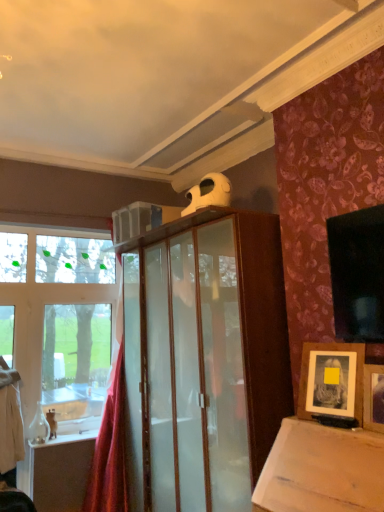
Question: Is wooden framed photo at lower right, the first picture frame viewed from the back, at the left side of red velvet curtain at left?

Choices:
 (A) yes
 (B) no

Answer: (B)

Question: Could you tell me if wooden framed photo at lower right, the 2th picture frame when ordered from front to back, is turned towards red velvet curtain at left?

Choices:
 (A) no
 (B) yes

Answer: (A)

Question: Is wooden framed photo at lower right, the 2th picture frame when ordered from front to back, facing away from red velvet curtain at left?

Choices:
 (A) yes
 (B) no

Answer: (B)

Question: Is wooden framed photo at lower right, the 2th picture frame when ordered from front to back, beside red velvet curtain at left?

Choices:
 (A) no
 (B) yes

Answer: (A)

Question: Is wooden framed photo at lower right, the 2th picture frame when ordered from front to back, far from red velvet curtain at left?

Choices:
 (A) no
 (B) yes

Answer: (B)

Question: Considering the positions of red velvet curtain at left and wooden framed photo at lower right, the 2th picture frame when ordered from front to back, in the image, is red velvet curtain at left wider or thinner than wooden framed photo at lower right, the 2th picture frame when ordered from front to back,?

Choices:
 (A) thin
 (B) wide

Answer: (B)

Question: Based on their sizes in the image, would you say red velvet curtain at left is bigger or smaller than wooden framed photo at lower right, the first picture frame viewed from the back?

Choices:
 (A) small
 (B) big

Answer: (B)

Question: Relative to wooden framed photo at lower right, the 2th picture frame when ordered from front to back, is red velvet curtain at left in front or behind?

Choices:
 (A) front
 (B) behind

Answer: (B)

Question: From the image's perspective, is red velvet curtain at left located above or below wooden framed photo at lower right, the 2th picture frame when ordered from front to back?

Choices:
 (A) above
 (B) below

Answer: (B)

Question: Based on their positions, is wooden framed photo at lower right, the 2th picture frame when ordered from front to back, located to the left or right of wooden picture frame at upper right, which ranks as the first picture frame in front-to-back order?

Choices:
 (A) left
 (B) right

Answer: (A)

Question: From a real-world perspective, is wooden framed photo at lower right, the 2th picture frame when ordered from front to back, positioned above or below wooden picture frame at upper right, which ranks as the first picture frame in front-to-back order?

Choices:
 (A) above
 (B) below

Answer: (A)

Question: In terms of width, does wooden framed photo at lower right, the 2th picture frame when ordered from front to back, look wider or thinner when compared to wooden picture frame at upper right, placed as the second picture frame when sorted from back to front?

Choices:
 (A) wide
 (B) thin

Answer: (A)

Question: Is wooden framed photo at lower right, the 2th picture frame when ordered from front to back, in front of or behind wooden picture frame at upper right, which ranks as the first picture frame in front-to-back order, in the image?

Choices:
 (A) behind
 (B) front

Answer: (A)

Question: Is red velvet curtain at left inside or outside of wooden picture frame at upper right, which ranks as the first picture frame in front-to-back order?

Choices:
 (A) inside
 (B) outside

Answer: (B)

Question: From their relative heights in the image, would you say red velvet curtain at left is taller or shorter than wooden picture frame at upper right, placed as the second picture frame when sorted from back to front?

Choices:
 (A) tall
 (B) short

Answer: (A)